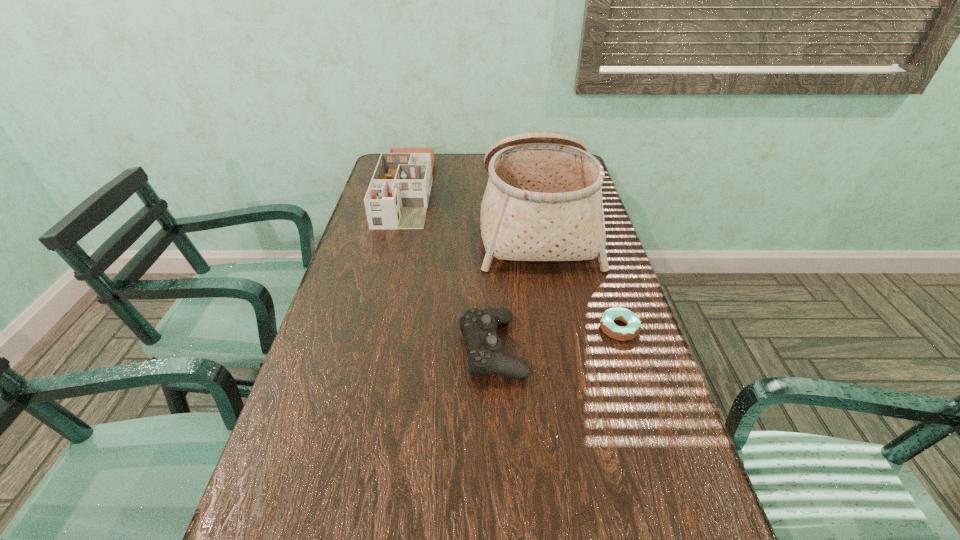
In order to click on the tallest object in this screenshot , I will do [x=543, y=201].

Image resolution: width=960 pixels, height=540 pixels. In order to click on the third shortest object in this screenshot , I will do `click(398, 195)`.

In order to click on dollhouse in this screenshot , I will do `click(398, 195)`.

Identify the location of the second shortest object. The image size is (960, 540). (484, 348).

The height and width of the screenshot is (540, 960). In order to click on doughnut in this screenshot , I will do `click(633, 328)`.

The width and height of the screenshot is (960, 540). Find the location of `vacant position located 0.230m with the lid open on the basket`. vacant position located 0.230m with the lid open on the basket is located at coordinates (410, 223).

Where is `free spot located with the lid open on the basket`? Image resolution: width=960 pixels, height=540 pixels. free spot located with the lid open on the basket is located at coordinates (441, 223).

Find the location of `free space located 0.380m with the lid open on the basket`. free space located 0.380m with the lid open on the basket is located at coordinates (365, 223).

Find the location of `free region located at the front door of the third shortest object`. free region located at the front door of the third shortest object is located at coordinates (385, 278).

Locate an element on the screen. This screenshot has height=540, width=960. vacant space located on the front of the control is located at coordinates (497, 539).